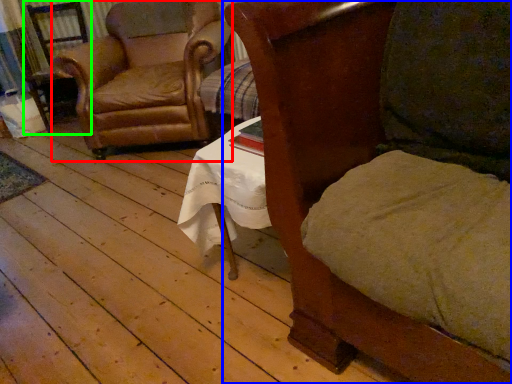
Question: Which is farther away from chair (highlighted by a red box)? chair (highlighted by a blue box) or armchair (highlighted by a green box)?

Choices:
 (A) chair
 (B) armchair

Answer: (A)